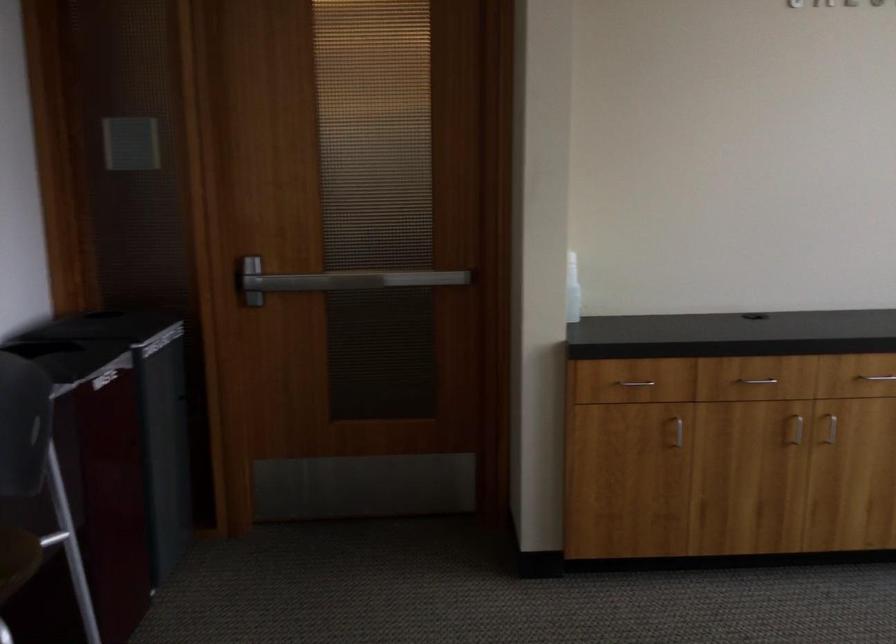
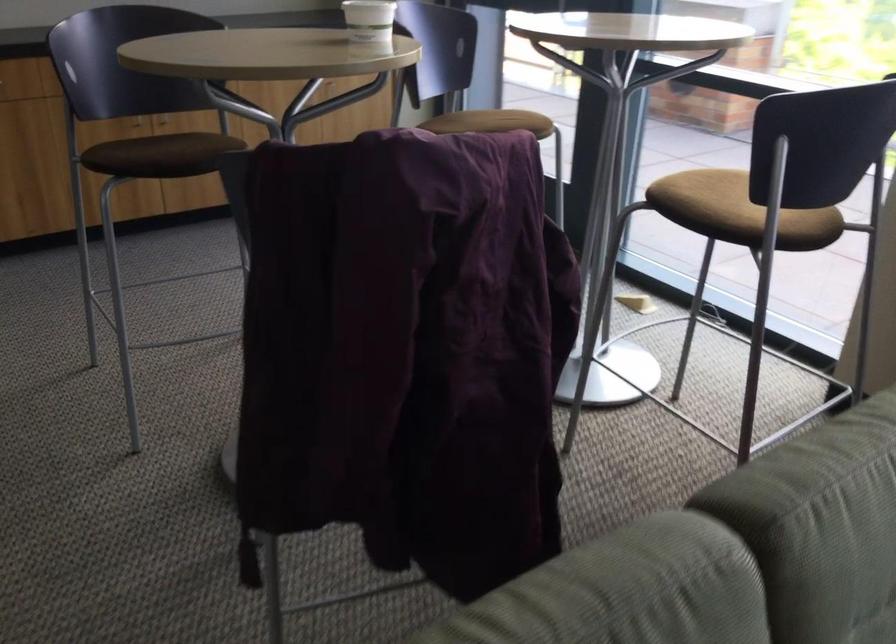
Question: I am providing you with two images of the same scene from different viewpoints. Please identify which objects are invisible in image2.

Choices:
 (A) black control dial
 (B) white paper cup
 (C) metal drawer handle
 (D) chair sitting surface

Answer: (C)